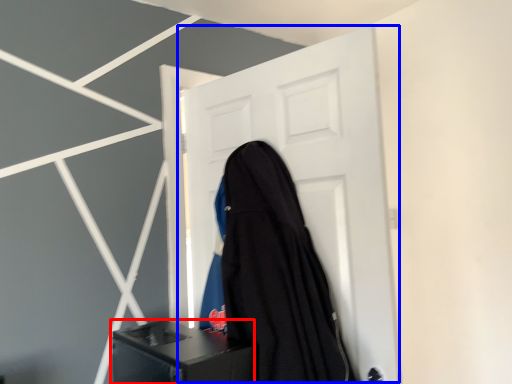
Question: Which point is closer to the camera, furniture (highlighted by a red box) or door (highlighted by a blue box)?

Choices:
 (A) furniture
 (B) door

Answer: (A)